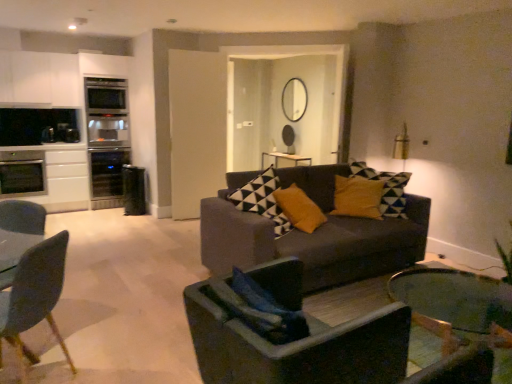
Describe the element at coordinates (458, 319) in the screenshot. The height and width of the screenshot is (384, 512). I see `wooden glossy coffee table at lower center` at that location.

What is the approximate height of wooden glossy coffee table at lower center?

wooden glossy coffee table at lower center is 15.70 inches in height.

What is the approximate width of satin black oven at left, which is the third appliance from left to right?

It is 23.39 inches.

The height and width of the screenshot is (384, 512). Describe the element at coordinates (40, 79) in the screenshot. I see `white matte cabinet at upper left` at that location.

At what (x,y) coordinates should I click in order to perform the action: click on matte gray couch at center. Please return your answer as a coordinate pair (x, y). Looking at the image, I should click on (312, 240).

How much space does satin silver oven at left, which is counted as the 3th appliance, starting from the right, occupy horizontally?

The width of satin silver oven at left, which is counted as the 3th appliance, starting from the right, is 24.01 inches.

The image size is (512, 384). I want to click on wooden glossy coffee table at lower center, so click(x=458, y=319).

Can you confirm if matte gray chair at left, the second chair viewed from the right, is taller than matte black mirror at upper center?

Correct, matte gray chair at left, the second chair viewed from the right, is much taller as matte black mirror at upper center.

Does matte gray chair at left, the first chair positioned from the left, touch matte black mirror at upper center?

matte gray chair at left, the first chair positioned from the left, is not next to matte black mirror at upper center, and they're not touching.

Considering the points (44, 295) and (297, 94), which point is in front, point (44, 295) or point (297, 94)?

The point (44, 295) is closer to the camera.

In order to click on chair that appears above the black glass wine cooler at left, arranged as the second appliance when viewed from the right (from a real-world perspective) in this screenshot , I will do `click(35, 295)`.

From the picture: Which object is positioned more to the left, matte gray chair at left, the first chair positioned from the left, or black glass wine cooler at left, acting as the 2th appliance starting from the left?

From the viewer's perspective, black glass wine cooler at left, acting as the 2th appliance starting from the left, appears more on the left side.

Can you confirm if matte gray chair at left, the second chair viewed from the right, is smaller than black glass wine cooler at left, acting as the 2th appliance starting from the left?

Yes.

From the image's perspective, would you say matte gray chair at left, the second chair viewed from the right, is positioned over black glass wine cooler at left, arranged as the second appliance when viewed from the right?

Actually, matte gray chair at left, the second chair viewed from the right, appears below black glass wine cooler at left, arranged as the second appliance when viewed from the right, in the image.

There is a satin black oven at left, the first appliance in the right-to-left sequence. Where is `the 1st appliance below it (from a real-world perspective)`? This screenshot has width=512, height=384. the 1st appliance below it (from a real-world perspective) is located at coordinates (22, 173).

Is satin silver oven at left, which is counted as the 3th appliance, starting from the right, bigger or smaller than satin black oven at left, the first appliance in the right-to-left sequence?

In the image, satin silver oven at left, which is counted as the 3th appliance, starting from the right, appears to be smaller than satin black oven at left, the first appliance in the right-to-left sequence.

Considering the points (16, 180) and (109, 151), which point is behind, point (16, 180) or point (109, 151)?

Point (109, 151)

Considering the relative sizes of satin silver oven at left, marked as the first appliance in a left-to-right arrangement, and matte gray couch at center in the image provided, is satin silver oven at left, marked as the first appliance in a left-to-right arrangement, bigger than matte gray couch at center?

No, satin silver oven at left, marked as the first appliance in a left-to-right arrangement, is not bigger than matte gray couch at center.

Is satin silver oven at left, which is counted as the 3th appliance, starting from the right, next to matte gray couch at center?

No, satin silver oven at left, which is counted as the 3th appliance, starting from the right, is not making contact with matte gray couch at center.

Consider the image. Could matte gray couch at center be considered to be inside satin silver oven at left, marked as the first appliance in a left-to-right arrangement?

No, matte gray couch at center is not a part of satin silver oven at left, marked as the first appliance in a left-to-right arrangement.

From the image's perspective, is satin silver oven at left, marked as the first appliance in a left-to-right arrangement, above or below matte gray couch at center?

Based on their image positions, satin silver oven at left, marked as the first appliance in a left-to-right arrangement, is located above matte gray couch at center.

In terms of width, does white matte cabinet at upper left look wider or thinner when compared to black glass wine cooler at left, acting as the 2th appliance starting from the left?

Considering their sizes, white matte cabinet at upper left looks slimmer than black glass wine cooler at left, acting as the 2th appliance starting from the left.

Is the position of white matte cabinet at upper left less distant than that of black glass wine cooler at left, acting as the 2th appliance starting from the left?

Yes, it is.

Is white matte cabinet at upper left in contact with black glass wine cooler at left, acting as the 2th appliance starting from the left?

white matte cabinet at upper left and black glass wine cooler at left, acting as the 2th appliance starting from the left, are clearly separated.

From the image's perspective, who appears lower, white matte cabinet at upper left or black glass wine cooler at left, arranged as the second appliance when viewed from the right?

black glass wine cooler at left, arranged as the second appliance when viewed from the right, from the image's perspective.

Can you tell me how much black glass wine cooler at left, arranged as the second appliance when viewed from the right, and satin black oven at left, the first appliance in the right-to-left sequence, differ in facing direction?

The facing directions of black glass wine cooler at left, arranged as the second appliance when viewed from the right, and satin black oven at left, the first appliance in the right-to-left sequence, are 0.000529 degrees apart.

Consider the image. From a real-world perspective, relative to satin black oven at left, which is the third appliance from left to right, is black glass wine cooler at left, arranged as the second appliance when viewed from the right, vertically above or below?

black glass wine cooler at left, arranged as the second appliance when viewed from the right, is situated lower than satin black oven at left, which is the third appliance from left to right, in the real world.

There is a satin black oven at left, the first appliance in the right-to-left sequence. At what (x,y) coordinates should I click in order to perform the action: click on the 2nd appliance below it (from the image's perspective). Please return your answer as a coordinate pair (x, y). Image resolution: width=512 pixels, height=384 pixels. Looking at the image, I should click on click(106, 171).

From the image's perspective, does black glass wine cooler at left, acting as the 2th appliance starting from the left, appear lower than satin black oven at left, the first appliance in the right-to-left sequence?

Yes, from the image's perspective, black glass wine cooler at left, acting as the 2th appliance starting from the left, is below satin black oven at left, the first appliance in the right-to-left sequence.

Where is `appliance that is the 2nd object to the right of the white matte cabinet at upper left, starting at the anchor`? The image size is (512, 384). appliance that is the 2nd object to the right of the white matte cabinet at upper left, starting at the anchor is located at coordinates (106, 139).

Is satin black oven at left, the first appliance in the right-to-left sequence, far from white matte cabinet at upper left?

satin black oven at left, the first appliance in the right-to-left sequence, is near white matte cabinet at upper left, not far away.

Which object is wider, satin black oven at left, which is the third appliance from left to right, or white matte cabinet at upper left?

satin black oven at left, which is the third appliance from left to right, is wider.

Which of these two, satin black oven at left, which is the third appliance from left to right, or white matte cabinet at upper left, stands shorter?

white matte cabinet at upper left.

From a real-world perspective, starting from the matte black mirror at upper center, which chair is the 1st one below it? Please provide its 2D coordinates.

[(35, 295)]

Identify the location of the 3rd appliance behind the matte gray chair at left, the first chair positioned from the left, starting your count from the anchor. (106, 171).

Which object lies nearer to the anchor point matte gray couch at center, matte black mirror at upper center or wooden glossy coffee table at lower center?

wooden glossy coffee table at lower center.

Looking at the image, which one is located further to satin silver oven at left, which is counted as the 3th appliance, starting from the right, dark gray fabric chair at center, which appears as the 2th chair when viewed from the left, or white matte cabinet at upper left?

dark gray fabric chair at center, which appears as the 2th chair when viewed from the left.

Based on the photo, which object lies further to the anchor point satin silver oven at left, marked as the first appliance in a left-to-right arrangement, white matte cabinet at upper left or wooden glossy coffee table at lower center?

wooden glossy coffee table at lower center is further to satin silver oven at left, marked as the first appliance in a left-to-right arrangement.

Which object lies further to the anchor point wooden glossy coffee table at lower center, satin black oven at left, the first appliance in the right-to-left sequence, or satin silver oven at left, which is counted as the 3th appliance, starting from the right?

Based on the image, satin silver oven at left, which is counted as the 3th appliance, starting from the right, appears to be further to wooden glossy coffee table at lower center.

When comparing their distances from matte black mirror at upper center, does satin black oven at left, which is the third appliance from left to right, or matte gray couch at center seem further?

matte gray couch at center is further to matte black mirror at upper center.

Estimate the real-world distances between objects in this image. Which object is further from matte black mirror at upper center, matte gray chair at left, the first chair positioned from the left, or wooden glossy coffee table at lower center?

matte gray chair at left, the first chair positioned from the left.

Looking at the image, which one is located closer to white matte cabinet at upper left, matte gray chair at left, the first chair positioned from the left, or satin black oven at left, which is the third appliance from left to right?

satin black oven at left, which is the third appliance from left to right.

Which object lies nearer to the anchor point matte gray chair at left, the second chair viewed from the right, dark gray fabric chair at center, which appears as the 2th chair when viewed from the left, or black glass wine cooler at left, arranged as the second appliance when viewed from the right?

The object closer to matte gray chair at left, the second chair viewed from the right, is dark gray fabric chair at center, which appears as the 2th chair when viewed from the left.

Where is `chair positioned between dark gray fabric chair at center, which appears as the 2th chair when viewed from the left, and black glass wine cooler at left, acting as the 2th appliance starting from the left, from near to far`? The width and height of the screenshot is (512, 384). chair positioned between dark gray fabric chair at center, which appears as the 2th chair when viewed from the left, and black glass wine cooler at left, acting as the 2th appliance starting from the left, from near to far is located at coordinates (35, 295).

Identify the location of appliance between white matte cabinet at upper left and satin silver oven at left, which is counted as the 3th appliance, starting from the right, in the up-down direction. (106, 139).

The image size is (512, 384). Find the location of `coffee table located between dark gray fabric chair at center, which appears as the 2th chair when viewed from the left, and matte black mirror at upper center in the depth direction`. coffee table located between dark gray fabric chair at center, which appears as the 2th chair when viewed from the left, and matte black mirror at upper center in the depth direction is located at coordinates (458, 319).

Locate an element on the screen. The width and height of the screenshot is (512, 384). studio couch between matte gray chair at left, the first chair positioned from the left, and satin black oven at left, which is the third appliance from left to right, from front to back is located at coordinates (312, 240).